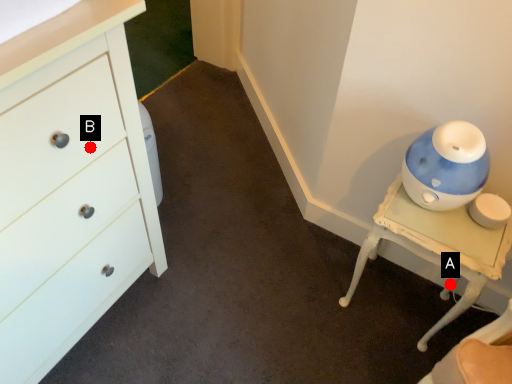
Question: Two points are circled on the image, labeled by A and B beside each circle. Which point is closer to the camera taking this photo?

Choices:
 (A) A is closer
 (B) B is closer

Answer: (B)